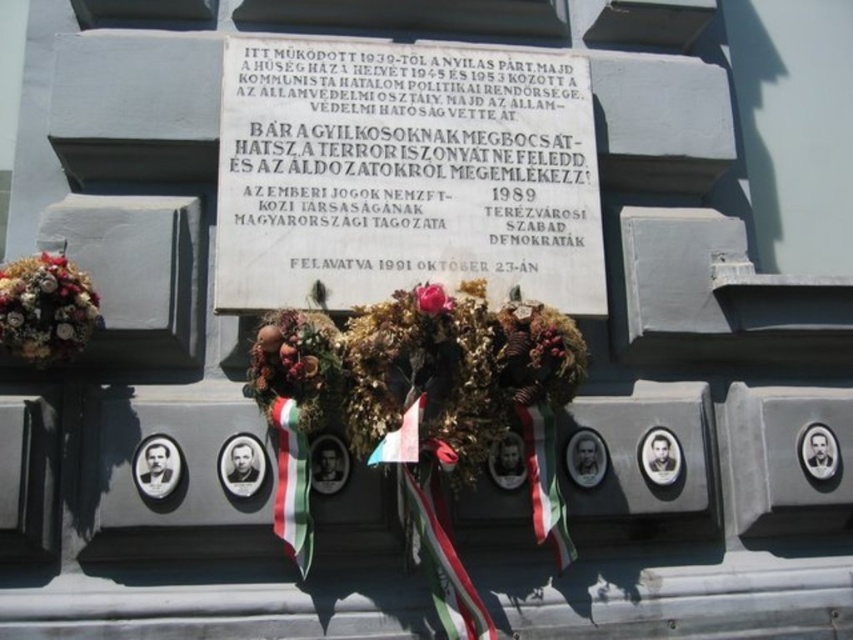
Question: Which object is positioned closest to the green and white striped ribbon at center?

Choices:
 (A) white marble plaque at center
 (B) dried floral bouquet at center

Answer: (B)

Question: Which of the following is the farthest from the observer?

Choices:
 (A) matte pink rose at center
 (B) green and white striped ribbon at center

Answer: (B)

Question: Does floral bouquet at lower left have a smaller size compared to green and white striped ribbon at center?

Choices:
 (A) yes
 (B) no

Answer: (B)

Question: Which of the following is the closest to the observer?

Choices:
 (A) matte pink rose at center
 (B) white marble plaque at center
 (C) green and white striped ribbon at center
 (D) floral bouquet at lower left

Answer: (D)

Question: Does white marble plaque at center appear on the left side of floral bouquet at lower left?

Choices:
 (A) yes
 (B) no

Answer: (B)

Question: Is floral bouquet at lower left to the left of green and white striped ribbon at center from the viewer's perspective?

Choices:
 (A) no
 (B) yes

Answer: (B)